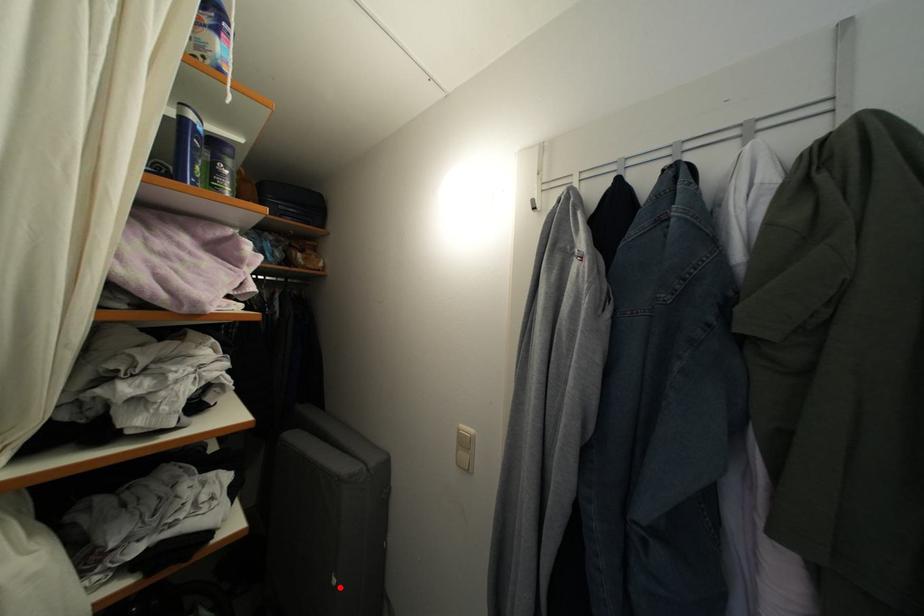
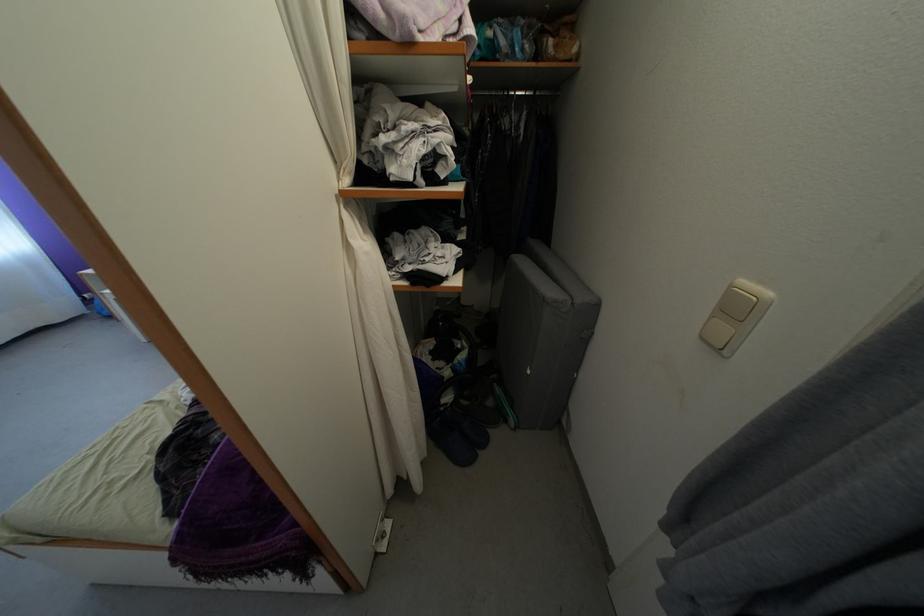
Find the pixel in the second image that matches the highlighted location in the first image.

(535, 378)